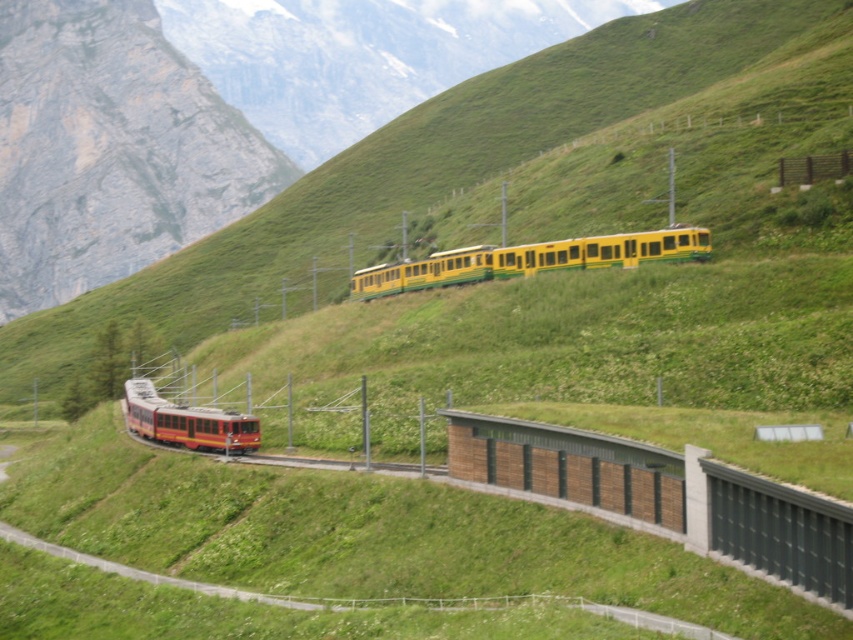
You are a railway engineer assessing the safety of the mountain railway. You need to determine if the yellow matte train at center can pass through a narrow tunnel that the matte red train at lower left previously navigated. Based on their widths, what is your assessment?

The yellow matte train at center might be wider than the matte red train at lower left, so it may not fit through the tunnel that the matte red train at lower left previously navigated. Further measurements are needed to confirm.

Looking at this image, you are a passenger on the yellow matte train at center and want to see the matte red train at lower left. Can you see it from your current position?

The matte red train at lower left is behind the yellow matte train at center, so you cannot see it from your current position.